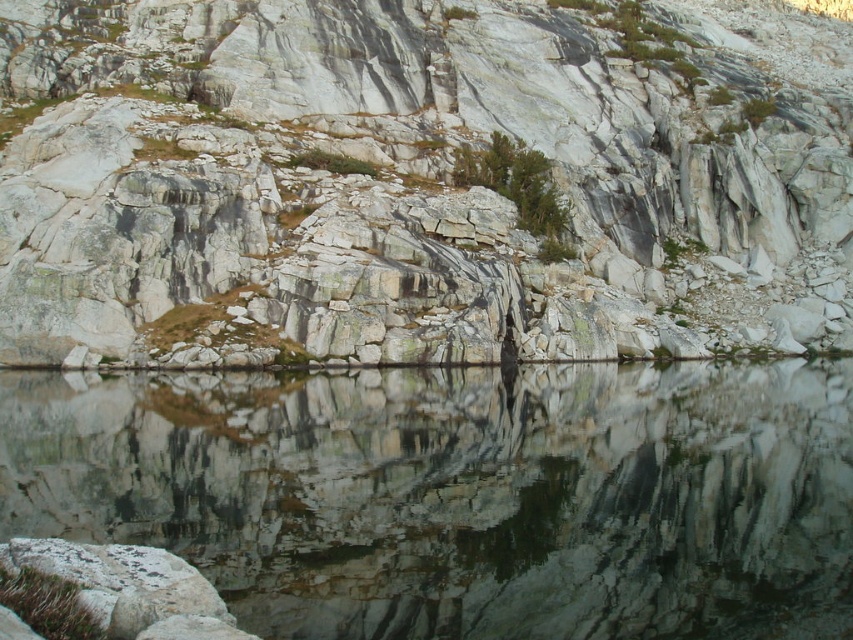
Question: Among these points, which one is nearest to the camera?

Choices:
 (A) (662, 301)
 (B) (833, 394)

Answer: (B)

Question: Which point is closer to the camera?

Choices:
 (A) (381, 36)
 (B) (144, 410)

Answer: (B)

Question: Which of the following is the closest to the observer?

Choices:
 (A) granite rock at center
 (B) reflective smooth water at center

Answer: (B)

Question: Does granite rock at center appear on the left side of reflective smooth water at center?

Choices:
 (A) no
 (B) yes

Answer: (A)

Question: Can you confirm if granite rock at center is bigger than reflective smooth water at center?

Choices:
 (A) yes
 (B) no

Answer: (A)

Question: Can you confirm if granite rock at center is positioned to the right of reflective smooth water at center?

Choices:
 (A) yes
 (B) no

Answer: (A)